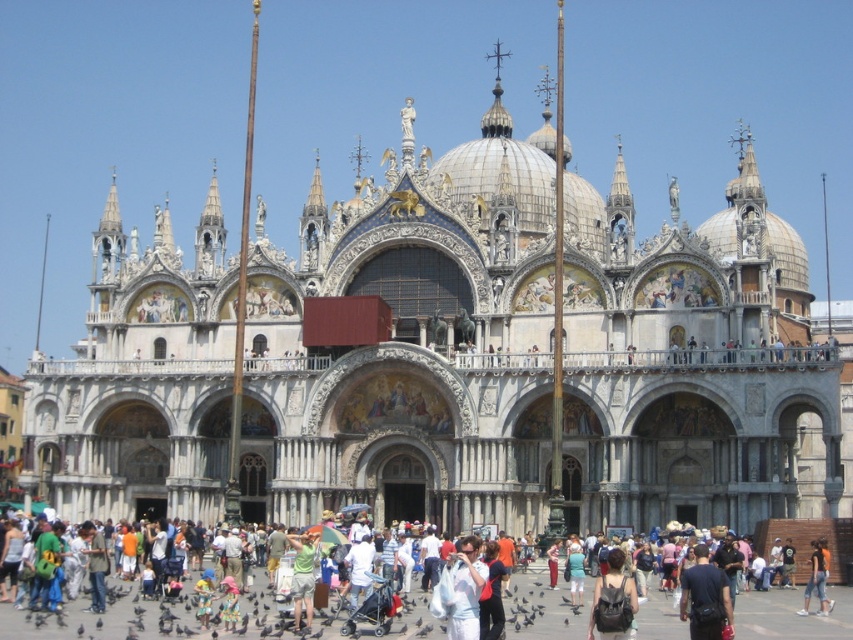
Question: Which object is closer to the camera taking this photo?

Choices:
 (A) denim shorts at lower right
 (B) green cotton shirt at center
 (C) white cotton shirt at center

Answer: (C)

Question: Is green cotton shirt at center thinner than denim shorts at lower right?

Choices:
 (A) no
 (B) yes

Answer: (B)

Question: Which of these objects is positioned farthest from the white cotton shirt at center?

Choices:
 (A) green cotton shirt at center
 (B) denim shorts at lower right

Answer: (B)

Question: Which of the following is the closest to the observer?

Choices:
 (A) (292, 572)
 (B) (821, 545)
 (C) (454, 637)

Answer: (C)

Question: Can you confirm if green cotton shirt at center is wider than denim shorts at lower right?

Choices:
 (A) yes
 (B) no

Answer: (B)

Question: Considering the relative positions of green cotton shirt at center and denim shorts at lower right in the image provided, where is green cotton shirt at center located with respect to denim shorts at lower right?

Choices:
 (A) below
 (B) above

Answer: (B)